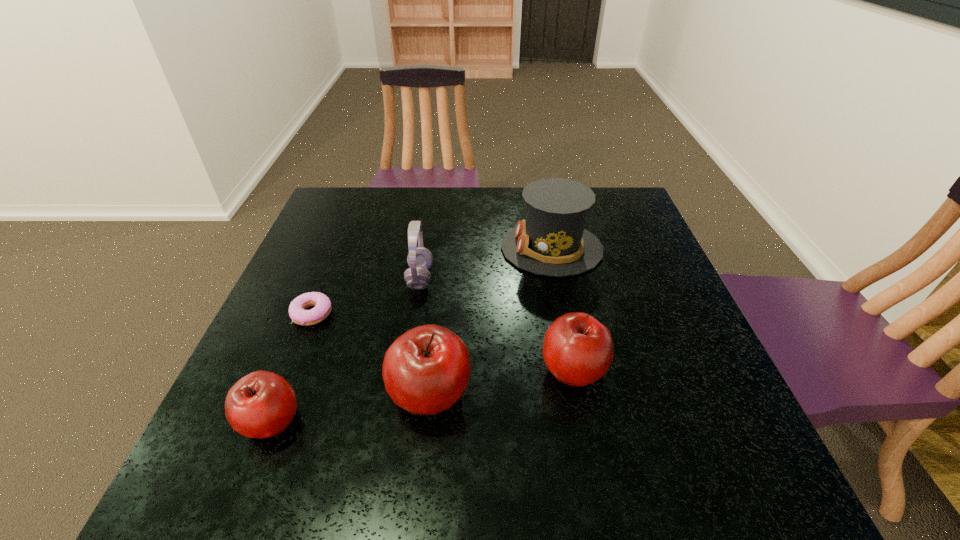
Locate an element on the screen. This screenshot has height=540, width=960. apple that is the second closest to the headset is located at coordinates (578, 350).

Where is `free space that satisfies the following two spatial constraints: 1. on the headband and ear cups of the headset; 2. on the left side of the rightmost apple`? The image size is (960, 540). free space that satisfies the following two spatial constraints: 1. on the headband and ear cups of the headset; 2. on the left side of the rightmost apple is located at coordinates (406, 369).

Find the location of a particular element. free spot that satisfies the following two spatial constraints: 1. on the headband and ear cups of the headset; 2. on the left side of the second apple from left to right is located at coordinates (402, 394).

This screenshot has height=540, width=960. I want to click on free point that satisfies the following two spatial constraints: 1. on the front side of the doughnut; 2. on the right side of the shortest apple, so (270, 421).